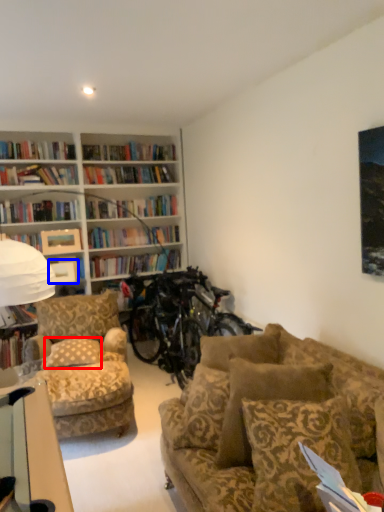
Question: Among these objects, which one is farthest to the camera, pillow (highlighted by a red box) or picture frame (highlighted by a blue box)?

Choices:
 (A) pillow
 (B) picture frame

Answer: (B)